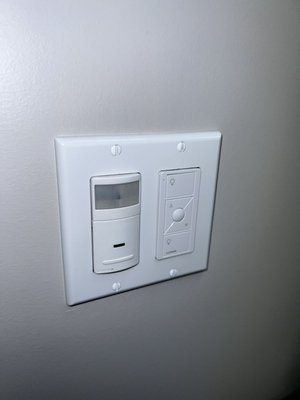
The width and height of the screenshot is (300, 400). Identify the location of space left of outlet. (x=43, y=243).